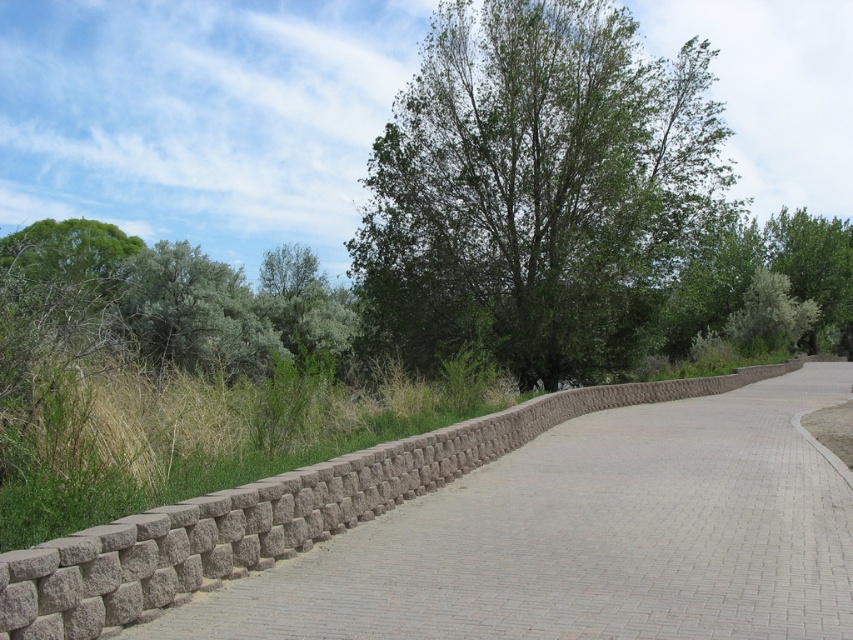
Is green leafy tree at center thinner than green leafy shrub at left?

In fact, green leafy tree at center might be wider than green leafy shrub at left.

Can you confirm if green leafy tree at center is positioned to the right of green leafy shrub at left?

Yes, green leafy tree at center is to the right of green leafy shrub at left.

Identify the location of green leafy tree at center. This screenshot has height=640, width=853. (537, 188).

Locate an element on the screen. The image size is (853, 640). green leafy tree at center is located at coordinates (537, 188).

Can you confirm if green leafy shrub at left is positioned below green leafy tree at upper right?

Indeed, green leafy shrub at left is positioned under green leafy tree at upper right.

Can you confirm if green leafy shrub at left is positioned to the right of green leafy tree at upper right?

In fact, green leafy shrub at left is to the left of green leafy tree at upper right.

At what (x,y) coordinates should I click in order to perform the action: click on green leafy shrub at left. Please return your answer as a coordinate pair (x, y). This screenshot has width=853, height=640. Looking at the image, I should click on (178, 296).

Can you confirm if brown brick pavement at center is bigger than green leafy tree at center?

Actually, brown brick pavement at center might be smaller than green leafy tree at center.

Is brown brick pavement at center closer to the viewer compared to green leafy tree at center?

Yes.

Between point (498, 637) and point (569, 211), which one is positioned in front?

Point (498, 637) is more forward.

In order to click on brown brick pavement at center in this screenshot , I will do `click(585, 538)`.